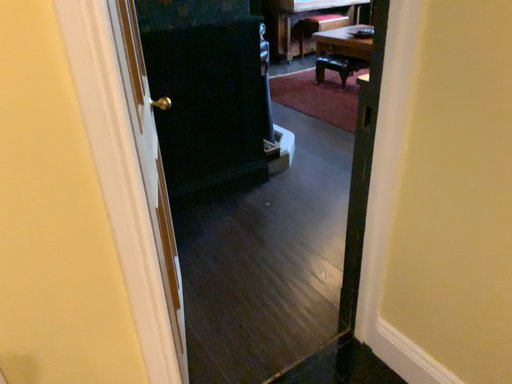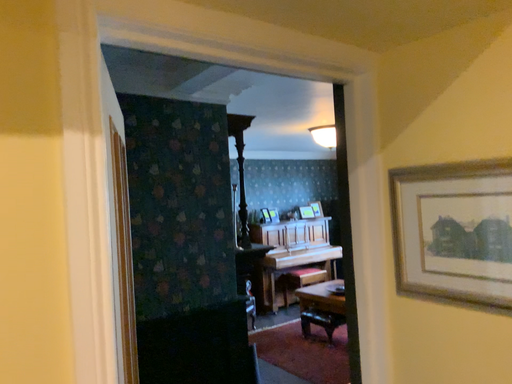
Question: How did the camera likely rotate when shooting the video?

Choices:
 (A) rotated upward
 (B) rotated downward

Answer: (A)